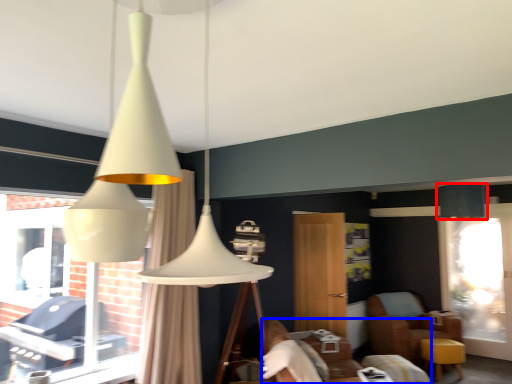
Question: Which object is further to the camera taking this photo, lamp (highlighted by a red box) or furniture (highlighted by a blue box)?

Choices:
 (A) lamp
 (B) furniture

Answer: (A)